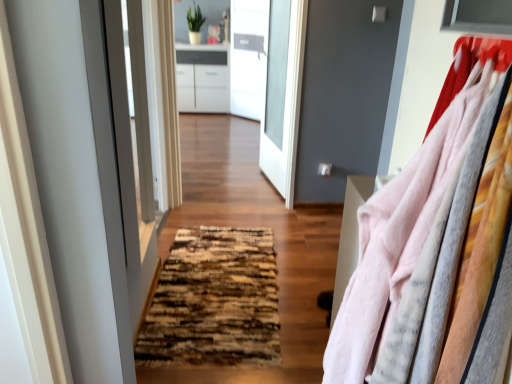
Question: Which is correct: brown textured rug at center is inside transparent glass door at center, or outside of it?

Choices:
 (A) inside
 (B) outside

Answer: (B)

Question: Is brown textured rug at center bigger or smaller than transparent glass door at center?

Choices:
 (A) big
 (B) small

Answer: (B)

Question: Which of these objects is positioned farthest from the brown textured rug at center?

Choices:
 (A) fluffy pink sweater at right
 (B) transparent glass door at center
 (C) white glossy cabinet at upper center
 (D) matte white screen door at center

Answer: (B)

Question: Considering the real-world distances, which object is farthest from the fluffy pink sweater at right?

Choices:
 (A) matte white screen door at center
 (B) white glossy cabinet at upper center
 (C) transparent glass door at center
 (D) brown textured rug at center

Answer: (C)